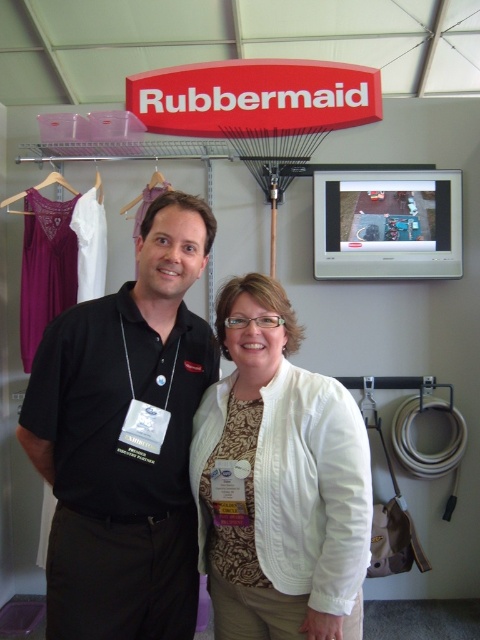
Between black shirt at left and purple fabric hanger at upper left, which one is positioned lower?

black shirt at left

Is black shirt at left taller than purple fabric hanger at upper left?

Yes, black shirt at left is taller than purple fabric hanger at upper left.

Identify the location of black shirt at left. (124, 440).

You are a GUI agent. You are given a task and a screenshot of the screen. Output one action in this format:
    pyautogui.click(x=<x>, y=<y>)
    Task: Click on the black shirt at left
    The image size is (480, 640).
    Given the screenshot: What is the action you would take?
    pyautogui.click(x=124, y=440)

Does purple fabric hanger at upper left have a greater width compared to wooden hanger at upper left?

Incorrect, purple fabric hanger at upper left's width does not surpass wooden hanger at upper left's.

Between purple fabric hanger at upper left and wooden hanger at upper left, which one appears on the left side from the viewer's perspective?

wooden hanger at upper left is more to the left.

Is point (126, 209) positioned in front of point (73, 193)?

That is True.

The image size is (480, 640). I want to click on purple fabric hanger at upper left, so (148, 193).

Is purple fabric hanger at upper left further to camera compared to white fabric hanger at left?

No, purple fabric hanger at upper left is closer to the viewer.

Who is more distant from viewer, [147,193] or [97,193]?

Positioned behind is point [97,193].

You are a GUI agent. You are given a task and a screenshot of the screen. Output one action in this format:
    pyautogui.click(x=<x>, y=<y>)
    Task: Click on the purple fabric hanger at upper left
    
    Given the screenshot: What is the action you would take?
    pyautogui.click(x=148, y=193)